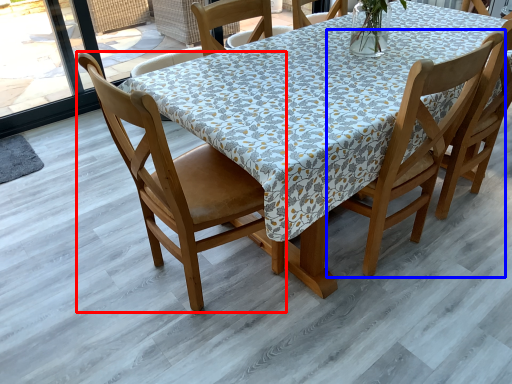
Question: Among these objects, which one is nearest to the camera, chair (highlighted by a red box) or chair (highlighted by a blue box)?

Choices:
 (A) chair
 (B) chair

Answer: (A)